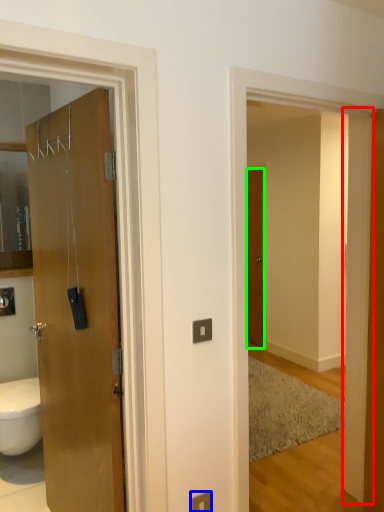
Question: Which is nearer to the pillar (highlighted by a red box)? electric outlet (highlighted by a blue box) or door (highlighted by a green box).

Choices:
 (A) electric outlet
 (B) door

Answer: (A)